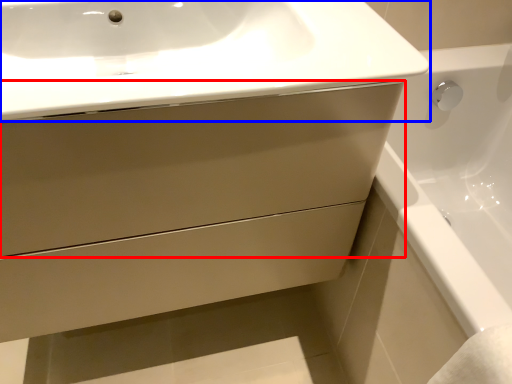
Question: Which object appears closest to the camera in this image, drawer (highlighted by a red box) or sink (highlighted by a blue box)?

Choices:
 (A) drawer
 (B) sink

Answer: (B)